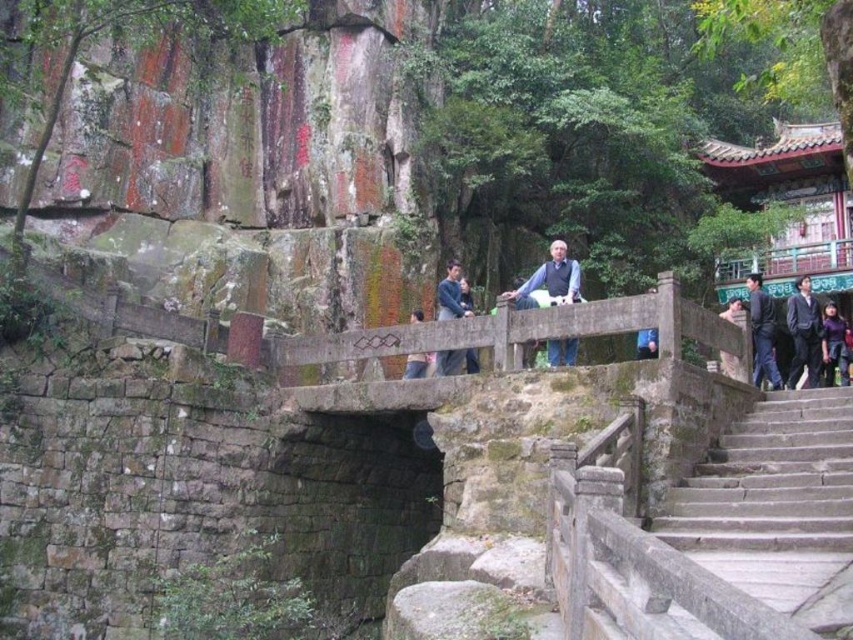
Does light blue denim jacket at center have a larger size compared to dark blue jeans at center?

Correct, light blue denim jacket at center is larger in size than dark blue jeans at center.

Describe the element at coordinates (550, 280) in the screenshot. I see `light blue denim jacket at center` at that location.

Which is behind, point (558, 355) or point (427, 355)?

Point (427, 355)

You are a GUI agent. You are given a task and a screenshot of the screen. Output one action in this format:
    pyautogui.click(x=<x>, y=<y>)
    Task: Click on the light blue denim jacket at center
    
    Given the screenshot: What is the action you would take?
    pyautogui.click(x=550, y=280)

Does stone stairs at center come behind stone bridge at center?

No.

Can you confirm if stone stairs at center is smaller than stone bridge at center?

Correct, stone stairs at center occupies less space than stone bridge at center.

Between point (589, 508) and point (538, 328), which one is positioned in front?

Positioned in front is point (589, 508).

Find the location of a particular element. stone stairs at center is located at coordinates (722, 532).

What do you see at coordinates (804, 333) in the screenshot? This screenshot has width=853, height=640. I see `black fabric jacket at right` at bounding box center [804, 333].

Is point (808, 292) in front of point (839, 337)?

That is True.

Locate an element on the screen. The height and width of the screenshot is (640, 853). black fabric jacket at right is located at coordinates (804, 333).